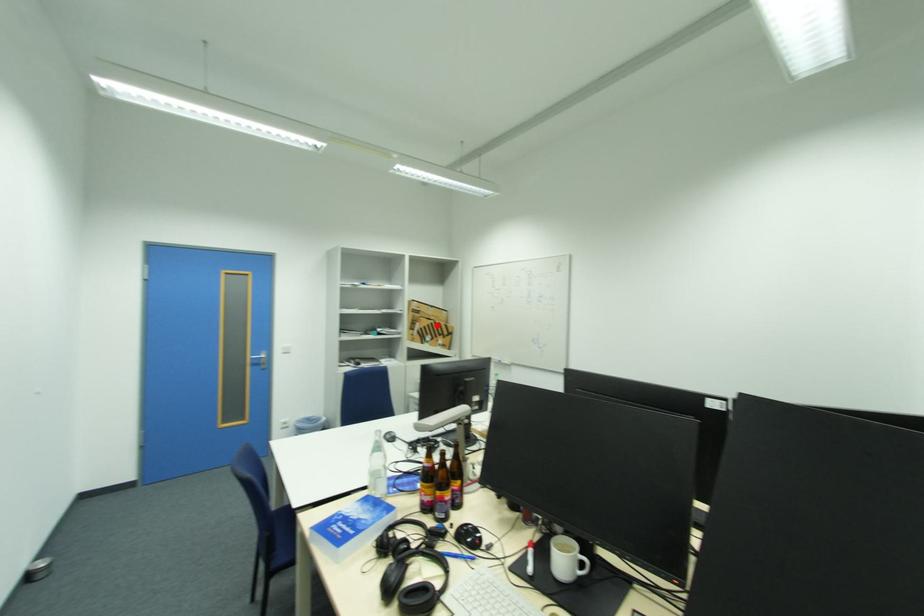
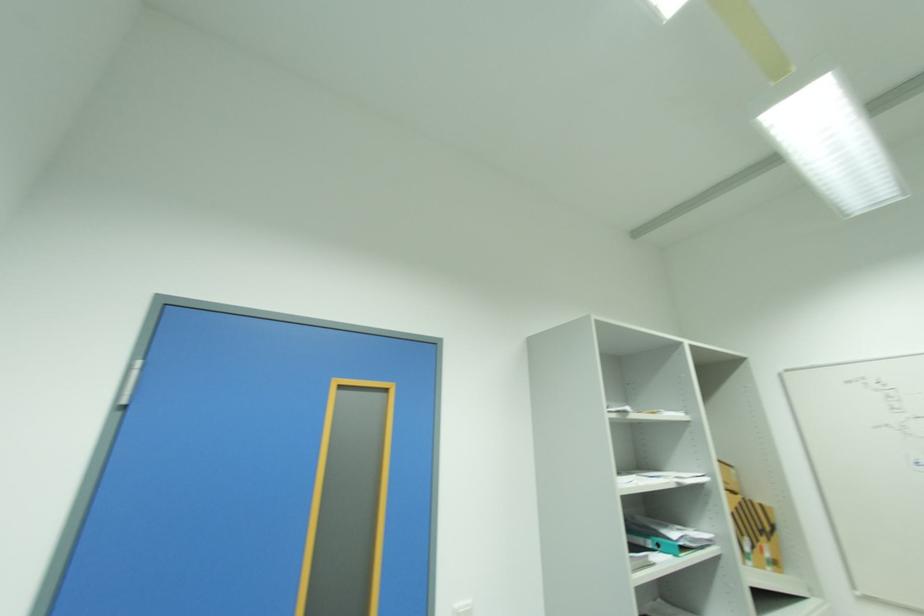
In the second image, find the point that corresponds to the highlighted location in the first image.

(746, 506)